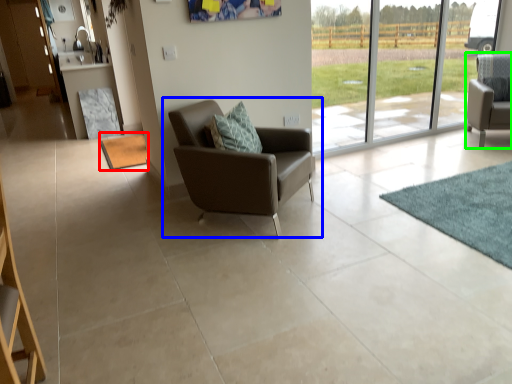
Question: Considering the real-world distances, which object is closest to mat (highlighted by a red box)? chair (highlighted by a blue box) or chair (highlighted by a green box).

Choices:
 (A) chair
 (B) chair

Answer: (A)